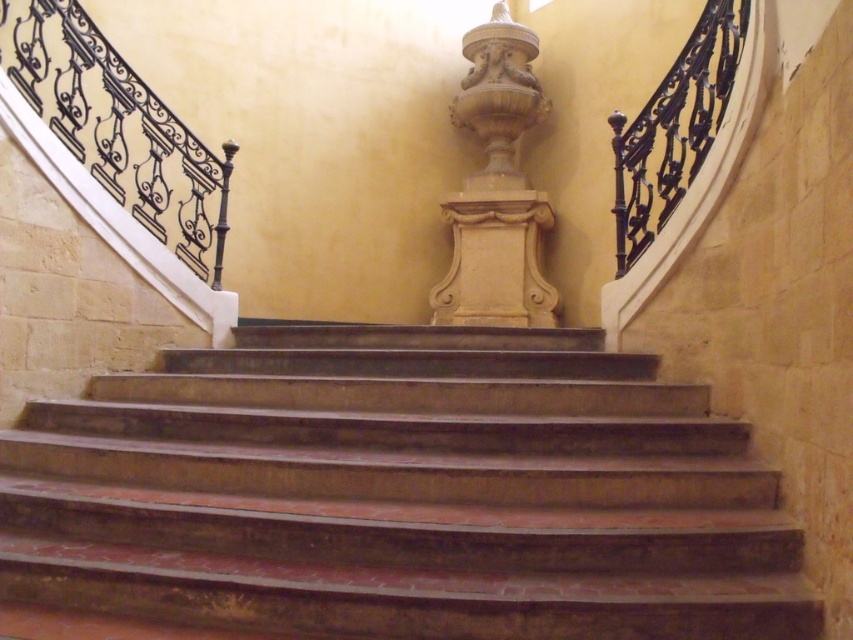
Question: Does brown stone stairs at center come behind white marble vase at center?

Choices:
 (A) yes
 (B) no

Answer: (B)

Question: Is black wrought iron railing at upper left thinner than white marble vase at center?

Choices:
 (A) no
 (B) yes

Answer: (B)

Question: Can you confirm if brown stone stairs at center is wider than black wrought iron railing at upper left?

Choices:
 (A) no
 (B) yes

Answer: (B)

Question: Based on their relative distances, which object is farther from the white marble vase at center?

Choices:
 (A) brown stone stairs at center
 (B) black wrought iron railing at upper right

Answer: (A)

Question: Which point is closer to the camera taking this photo?

Choices:
 (A) (392, 625)
 (B) (18, 26)
 (C) (683, 120)
 (D) (498, 65)

Answer: (A)

Question: Which object is positioned closest to the white marble vase at center?

Choices:
 (A) brown stone stairs at center
 (B) black wrought iron railing at upper right
 (C) black wrought iron railing at upper left

Answer: (B)